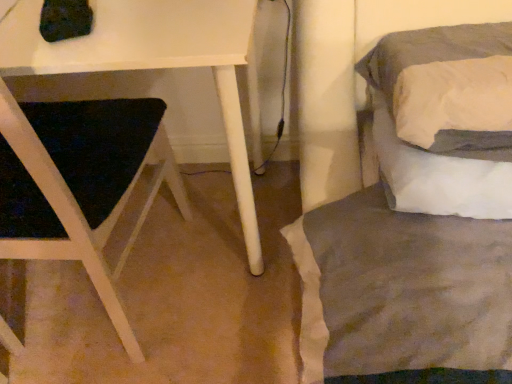
Question: Considering the positions of white matte table at left and gray fabric bed at right in the image, is white matte table at left bigger or smaller than gray fabric bed at right?

Choices:
 (A) big
 (B) small

Answer: (A)

Question: From the image's perspective, is white matte table at left positioned above or below gray fabric bed at right?

Choices:
 (A) above
 (B) below

Answer: (B)

Question: Is white matte table at left to the left or to the right of gray fabric bed at right in the image?

Choices:
 (A) right
 (B) left

Answer: (B)

Question: Is point (423, 36) closer or farther from the camera than point (18, 36)?

Choices:
 (A) closer
 (B) farther

Answer: (B)

Question: Considering the positions of gray fabric bed at right and white matte table at left in the image, is gray fabric bed at right taller or shorter than white matte table at left?

Choices:
 (A) tall
 (B) short

Answer: (B)

Question: From the image's perspective, is gray fabric bed at right above or below white matte table at left?

Choices:
 (A) below
 (B) above

Answer: (B)

Question: From a real-world perspective, relative to white matte table at left, is gray fabric bed at right vertically above or below?

Choices:
 (A) above
 (B) below

Answer: (A)